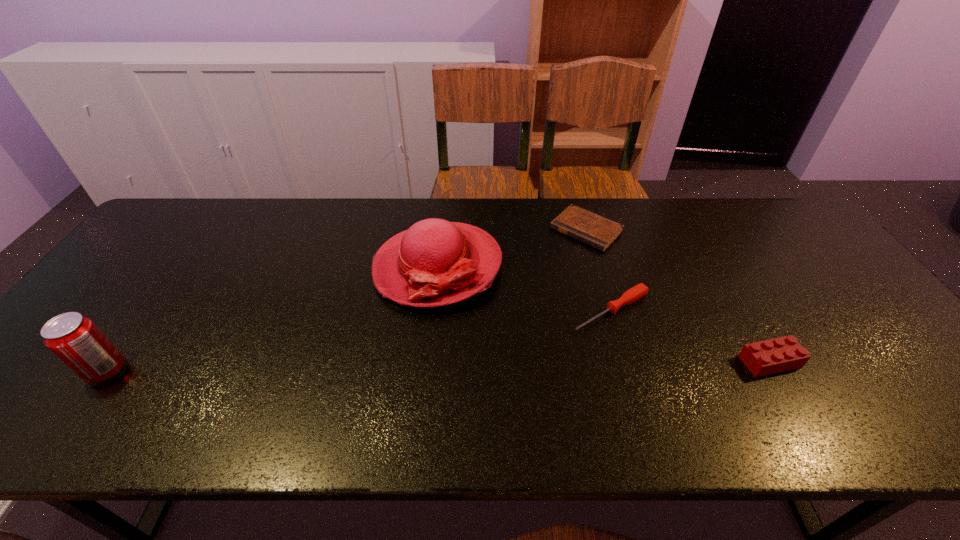
Locate an element on the screen. Lego present at the near edge is located at coordinates (762, 358).

The width and height of the screenshot is (960, 540). Find the location of `object present at the left edge`. object present at the left edge is located at coordinates (75, 339).

At what (x,y) coordinates should I click in order to perform the action: click on object that is at the near left corner. Please return your answer as a coordinate pair (x, y). This screenshot has height=540, width=960. Looking at the image, I should click on (75, 339).

In the image, there is a desktop. Identify the location of vacant space at the far edge. The height and width of the screenshot is (540, 960). (675, 199).

Find the location of a particular element. The width and height of the screenshot is (960, 540). vacant space at the near edge of the desktop is located at coordinates (429, 370).

The width and height of the screenshot is (960, 540). I want to click on vacant point at the left edge, so click(x=116, y=293).

Image resolution: width=960 pixels, height=540 pixels. In the image, there is a desktop. In order to click on vacant space at the right edge in this screenshot , I will do `click(845, 302)`.

Image resolution: width=960 pixels, height=540 pixels. In the image, there is a desktop. In order to click on vacant space at the near left corner in this screenshot , I will do `click(55, 380)`.

Locate an element on the screen. free space between the hat and the screwdriver is located at coordinates (524, 288).

The image size is (960, 540). I want to click on empty location between the diary and the Lego, so click(678, 295).